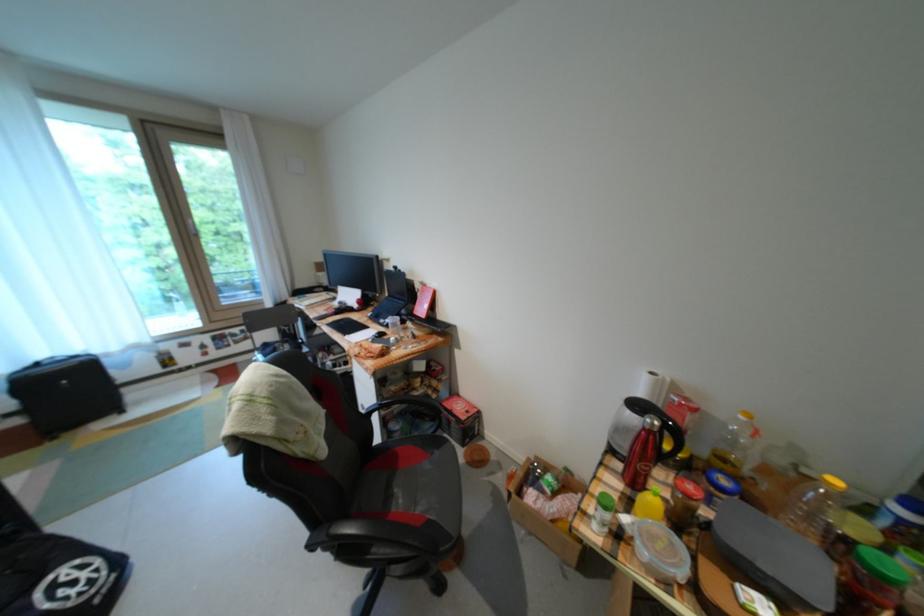
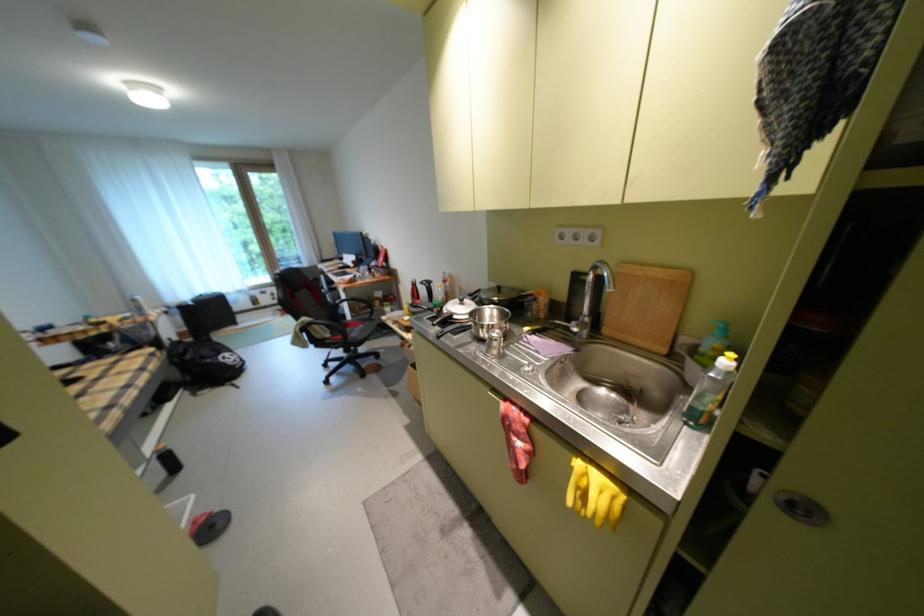
The images are taken continuously from a first-person perspective. In which direction are you moving?

The cameraman walked toward right, backward.